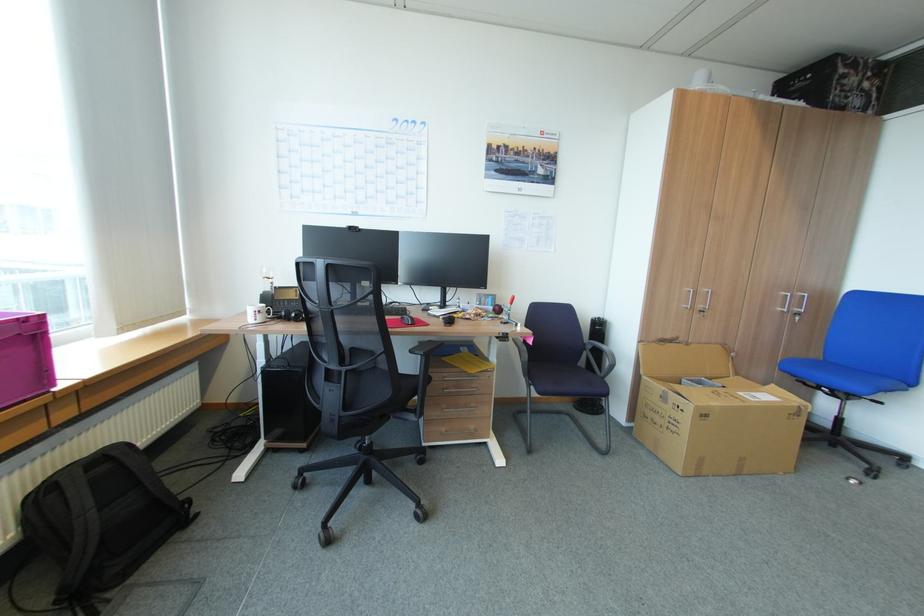
This screenshot has width=924, height=616. Identify the location of black backpack. (101, 522).